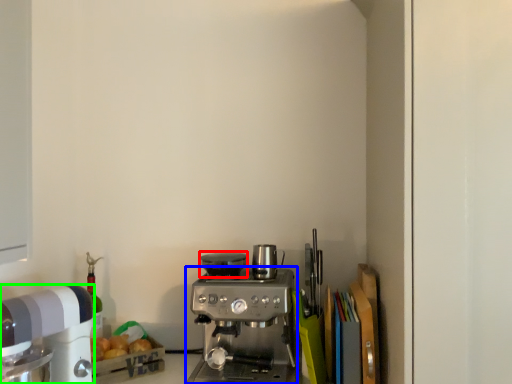
Question: Which object is the closest to the appliance (highlighted by a red box)? Choose among these: coffee maker (highlighted by a blue box) or kitchen appliance (highlighted by a green box).

Choices:
 (A) coffee maker
 (B) kitchen appliance

Answer: (A)